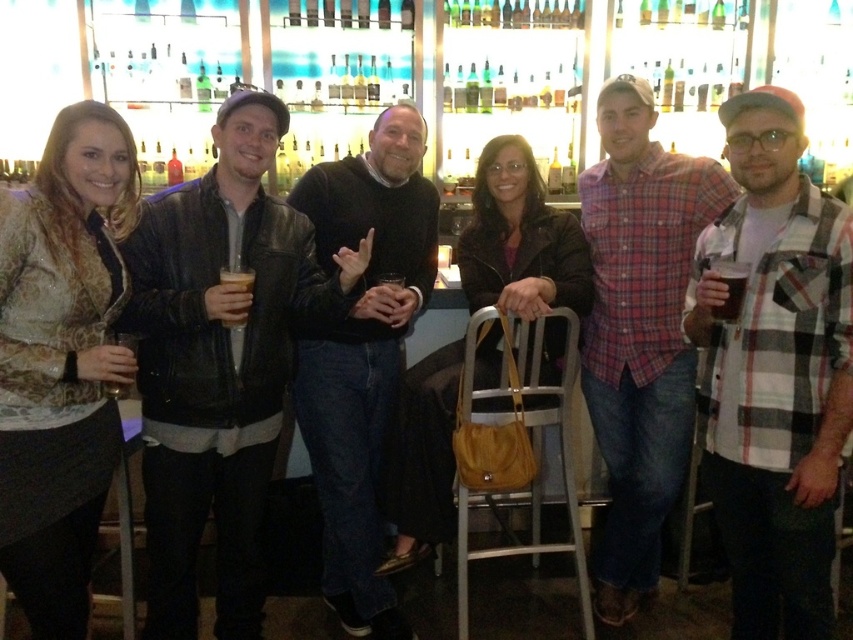
Is point (744, 282) farther from camera compared to point (219, 269)?

No, it is not.

You are a GUI agent. You are given a task and a screenshot of the screen. Output one action in this format:
    pyautogui.click(x=<x>, y=<y>)
    Task: Click on the dark brown glass at right
    The image size is (853, 640).
    Given the screenshot: What is the action you would take?
    pyautogui.click(x=730, y=289)

Where is `dark brown glass at right`? dark brown glass at right is located at coordinates (730, 289).

Can you confirm if leather jacket at center is thinner than translucent glass beer at center?

Incorrect, leather jacket at center's width is not less than translucent glass beer at center's.

Between point (305, 316) and point (387, 292), which one is positioned in front?

Point (387, 292) is more forward.

Is point (265, 308) behind point (376, 285)?

No, it is in front of (376, 285).

This screenshot has width=853, height=640. I want to click on leather jacket at center, so click(219, 362).

Can you confirm if leather jacket at center is smaller than translucent glass cup at center?

Actually, leather jacket at center might be larger than translucent glass cup at center.

Is leather jacket at center wider than translucent glass cup at center?

Yes, leather jacket at center is wider than translucent glass cup at center.

The width and height of the screenshot is (853, 640). Describe the element at coordinates (219, 362) in the screenshot. I see `leather jacket at center` at that location.

The width and height of the screenshot is (853, 640). Identify the location of leather jacket at center. (219, 362).